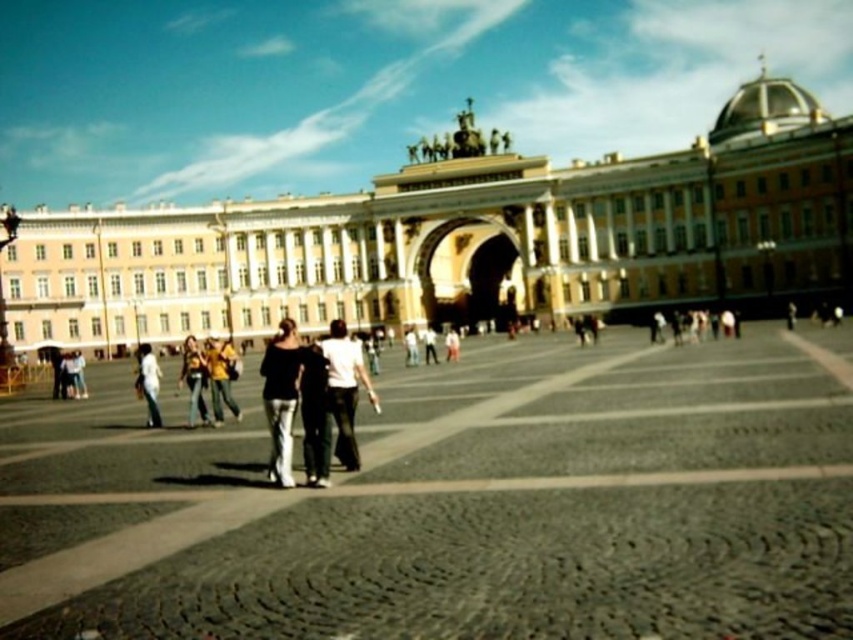
Question: Which of the following is the closest to the observer?

Choices:
 (A) (340, 444)
 (B) (286, 381)
 (C) (349, 404)
 (D) (585, 193)

Answer: (A)

Question: Does smooth stone pavement at center have a larger size compared to white cotton shirt at center?

Choices:
 (A) yes
 (B) no

Answer: (A)

Question: Is smooth stone pavement at center positioned behind matte black clothing at center?

Choices:
 (A) no
 (B) yes

Answer: (A)

Question: Which object appears farthest from the camera in this image?

Choices:
 (A) matte black top at center
 (B) matte black clothing at center

Answer: (A)

Question: Can you confirm if matte black top at center is positioned to the left of white cotton shirt at center?

Choices:
 (A) yes
 (B) no

Answer: (A)

Question: Among these objects, which one is nearest to the camera?

Choices:
 (A) smooth stone pavement at center
 (B) matte black clothing at center

Answer: (A)